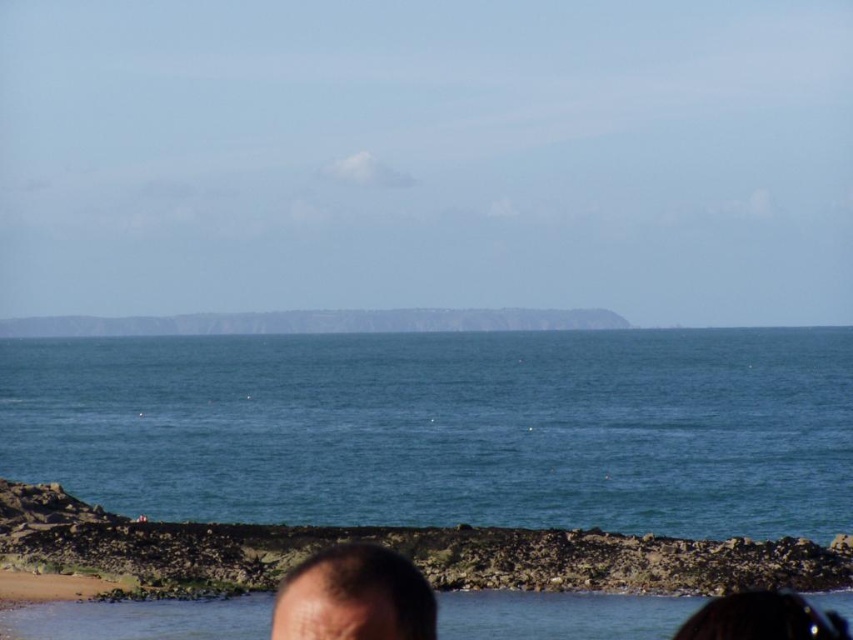
Question: Does blue water at center have a smaller size compared to rough stone coast at lower center?

Choices:
 (A) yes
 (B) no

Answer: (B)

Question: Is blue water at center closer to camera compared to dark brown hair at lower center?

Choices:
 (A) no
 (B) yes

Answer: (A)

Question: Is blue water at center to the left of dark brown hair at lower center from the viewer's perspective?

Choices:
 (A) yes
 (B) no

Answer: (A)

Question: Which object is closer to the camera taking this photo?

Choices:
 (A) blue water at center
 (B) rough stone coast at lower center

Answer: (B)

Question: Which object appears closest to the camera in this image?

Choices:
 (A) dark brown hair at lower center
 (B) blue water at center
 (C) rough stone coast at lower center

Answer: (A)

Question: Estimate the real-world distances between objects in this image. Which object is closer to the dark brown hair at lower center?

Choices:
 (A) blue water at center
 (B) rough stone coast at lower center

Answer: (B)